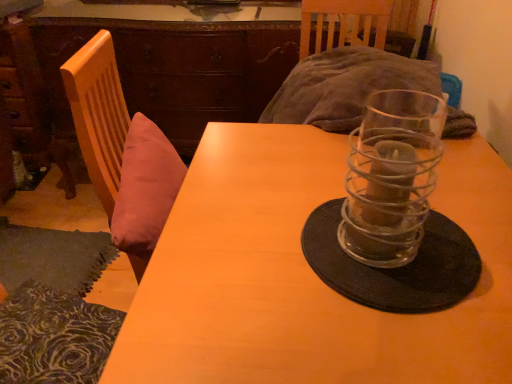
Image resolution: width=512 pixels, height=384 pixels. Find the location of `vacant space to the left of clear glass candle holder at center`. vacant space to the left of clear glass candle holder at center is located at coordinates (269, 252).